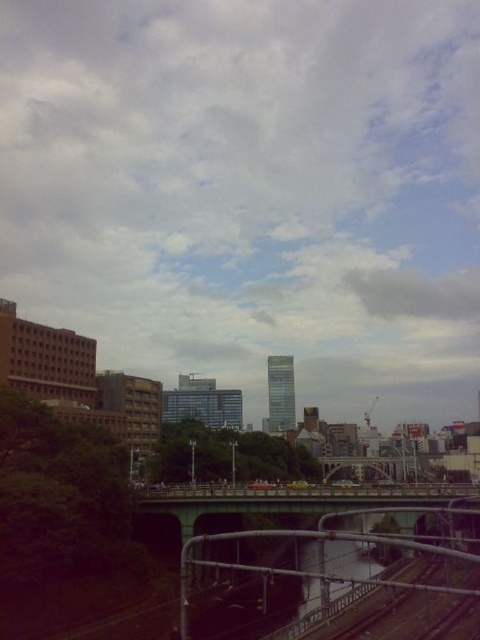
Can you confirm if green concrete bridge at center is positioned to the left of metallic gray bridge at center?

Indeed, green concrete bridge at center is positioned on the left side of metallic gray bridge at center.

Which is in front, point (399, 506) or point (373, 456)?

Point (399, 506) is in front.

Identify the location of green concrete bridge at center. (300, 500).